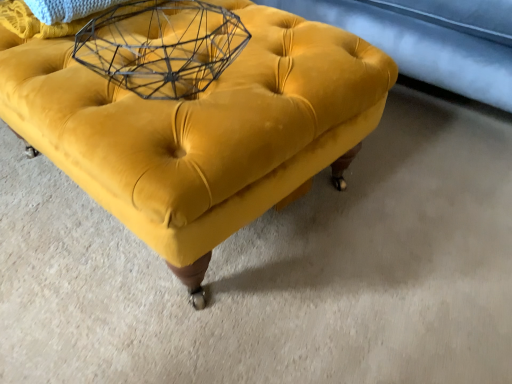
Question: Is wire mesh basket at upper center in front of or behind velvet yellow ottoman at center in the image?

Choices:
 (A) front
 (B) behind

Answer: (B)

Question: From the image's perspective, is wire mesh basket at upper center above or below velvet yellow ottoman at center?

Choices:
 (A) above
 (B) below

Answer: (A)

Question: Is wire mesh basket at upper center spatially inside velvet yellow ottoman at center, or outside of it?

Choices:
 (A) outside
 (B) inside

Answer: (B)

Question: Is velvet yellow ottoman at center spatially inside wire mesh basket at upper center, or outside of it?

Choices:
 (A) inside
 (B) outside

Answer: (B)

Question: From a real-world perspective, is velvet yellow ottoman at center above or below wire mesh basket at upper center?

Choices:
 (A) below
 (B) above

Answer: (A)

Question: Is velvet yellow ottoman at center bigger or smaller than wire mesh basket at upper center?

Choices:
 (A) big
 (B) small

Answer: (A)

Question: Considering their positions, is velvet yellow ottoman at center located in front of or behind wire mesh basket at upper center?

Choices:
 (A) behind
 (B) front

Answer: (B)